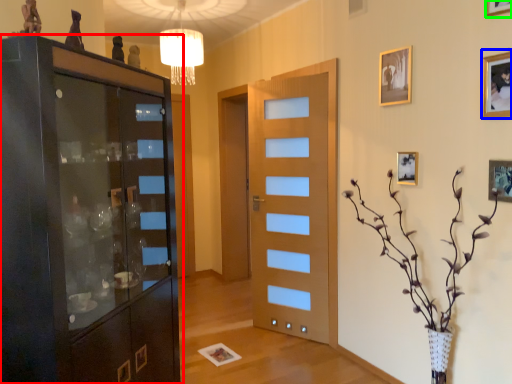
Question: Considering the real-world distances, which object is closest to cupboard (highlighted by a red box)? picture frame (highlighted by a blue box) or picture frame (highlighted by a green box).

Choices:
 (A) picture frame
 (B) picture frame

Answer: (A)